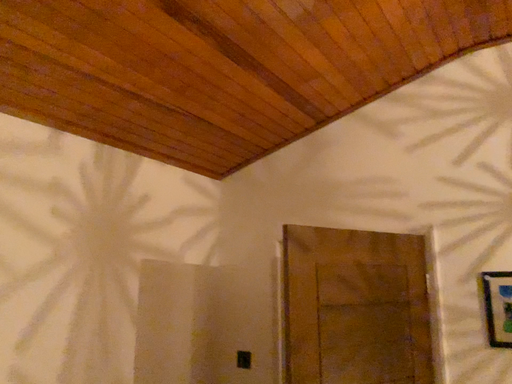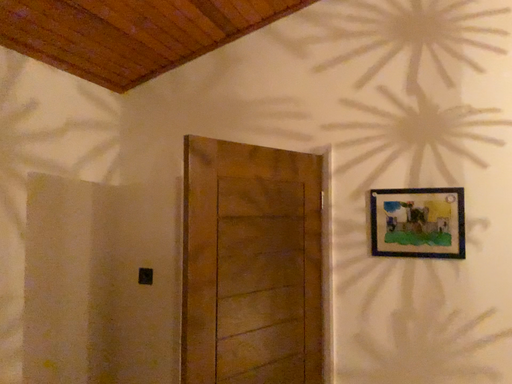
Question: Which way did the camera rotate in the video?

Choices:
 (A) rotated left
 (B) rotated right

Answer: (B)